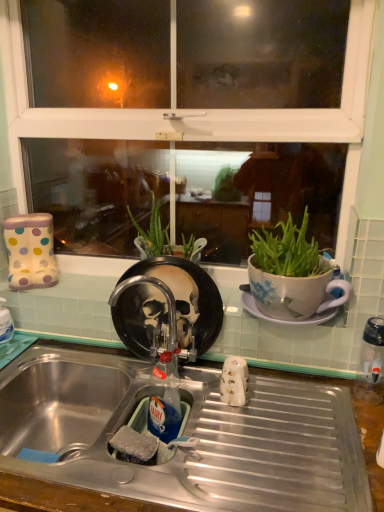
Where is `vacant location behind rubber sponge at sink`? The image size is (384, 512). vacant location behind rubber sponge at sink is located at coordinates (148, 414).